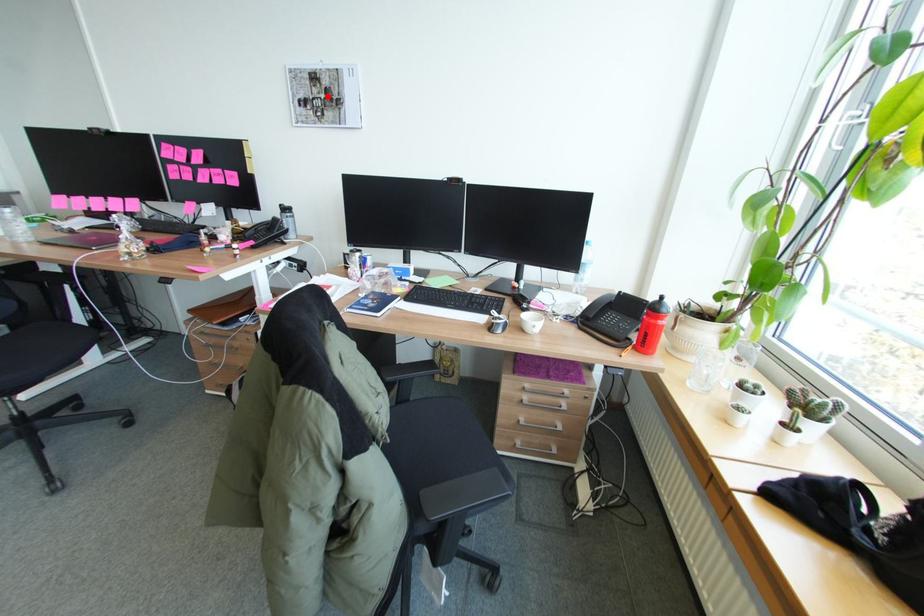
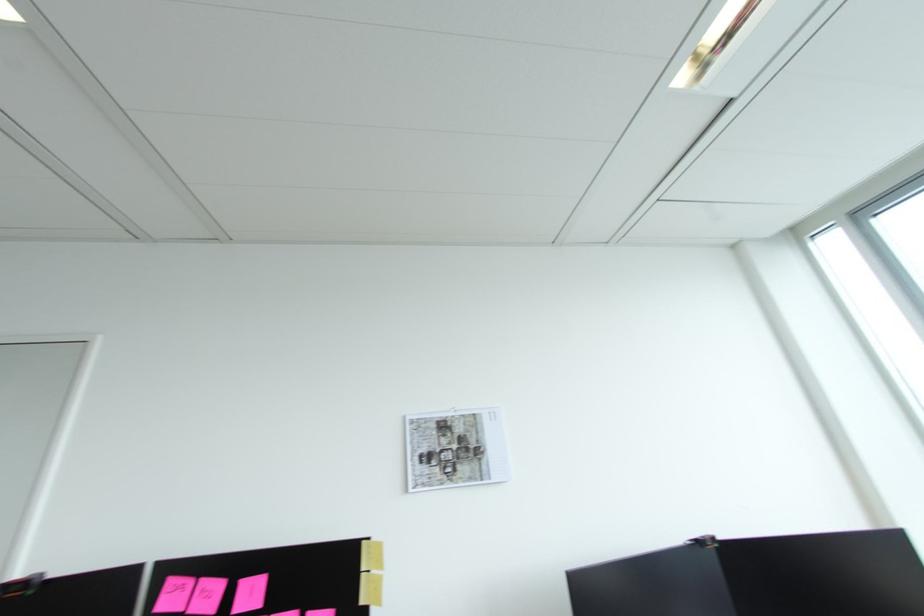
Where in the second image is the point corresponding to the highlighted location from the first image?

(459, 446)